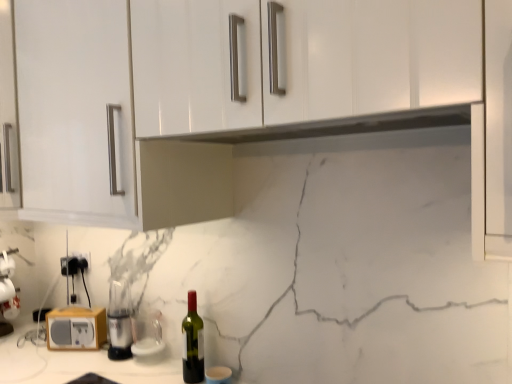
Question: From the image's perspective, is black plastic electric outlet at lower left, the 1th electric outlet in the left-to-right sequence, below green glass bottle at center?

Choices:
 (A) no
 (B) yes

Answer: (A)

Question: Is black plastic electric outlet at lower left, the 2th electric outlet when ordered from right to left, surrounding green glass bottle at center?

Choices:
 (A) no
 (B) yes

Answer: (A)

Question: Is black plastic electric outlet at lower left, the 2th electric outlet when ordered from right to left, to the left of green glass bottle at center from the viewer's perspective?

Choices:
 (A) yes
 (B) no

Answer: (A)

Question: Is black plastic electric outlet at lower left, the 2th electric outlet when ordered from right to left, positioned in front of green glass bottle at center?

Choices:
 (A) yes
 (B) no

Answer: (B)

Question: Considering the relative sizes of black plastic electric outlet at lower left, the 1th electric outlet in the left-to-right sequence, and green glass bottle at center in the image provided, is black plastic electric outlet at lower left, the 1th electric outlet in the left-to-right sequence, bigger than green glass bottle at center?

Choices:
 (A) yes
 (B) no

Answer: (B)

Question: Considering the relative positions of black plastic electric outlet at lower left, the 1th electric outlet in the left-to-right sequence, and green glass bottle at center in the image provided, is black plastic electric outlet at lower left, the 1th electric outlet in the left-to-right sequence, to the left or to the right of green glass bottle at center?

Choices:
 (A) left
 (B) right

Answer: (A)

Question: From the image's perspective, is black plastic electric outlet at lower left, the 2th electric outlet when ordered from right to left, located above or below green glass bottle at center?

Choices:
 (A) above
 (B) below

Answer: (A)

Question: Is point (61, 269) closer or farther from the camera than point (186, 322)?

Choices:
 (A) closer
 (B) farther

Answer: (B)

Question: Looking at their shapes, would you say black plastic electric outlet at lower left, the 1th electric outlet in the left-to-right sequence, is wider or thinner than green glass bottle at center?

Choices:
 (A) wide
 (B) thin

Answer: (B)

Question: In the image, is wooden radio at lower left, the third appliance when ordered from right to left, positioned in front of or behind green glass bottle at center?

Choices:
 (A) behind
 (B) front

Answer: (A)

Question: Would you say wooden radio at lower left, acting as the first appliance starting from the left, is to the left or to the right of green glass bottle at center in the picture?

Choices:
 (A) left
 (B) right

Answer: (A)

Question: Looking at their shapes, would you say wooden radio at lower left, the third appliance when ordered from right to left, is wider or thinner than green glass bottle at center?

Choices:
 (A) thin
 (B) wide

Answer: (A)

Question: In terms of size, does wooden radio at lower left, the third appliance when ordered from right to left, appear bigger or smaller than green glass bottle at center?

Choices:
 (A) big
 (B) small

Answer: (B)

Question: Relative to transparent glass at lower center, arranged as the first appliance when viewed from the right, is black plastic electric outlet at lower left, which is the first electric outlet in right-to-left order, in front or behind?

Choices:
 (A) front
 (B) behind

Answer: (B)

Question: Considering the positions of black plastic electric outlet at lower left, which appears as the 2th electric outlet when viewed from the left, and transparent glass at lower center, arranged as the first appliance when viewed from the right, in the image, is black plastic electric outlet at lower left, which appears as the 2th electric outlet when viewed from the left, wider or thinner than transparent glass at lower center, arranged as the first appliance when viewed from the right,?

Choices:
 (A) wide
 (B) thin

Answer: (B)